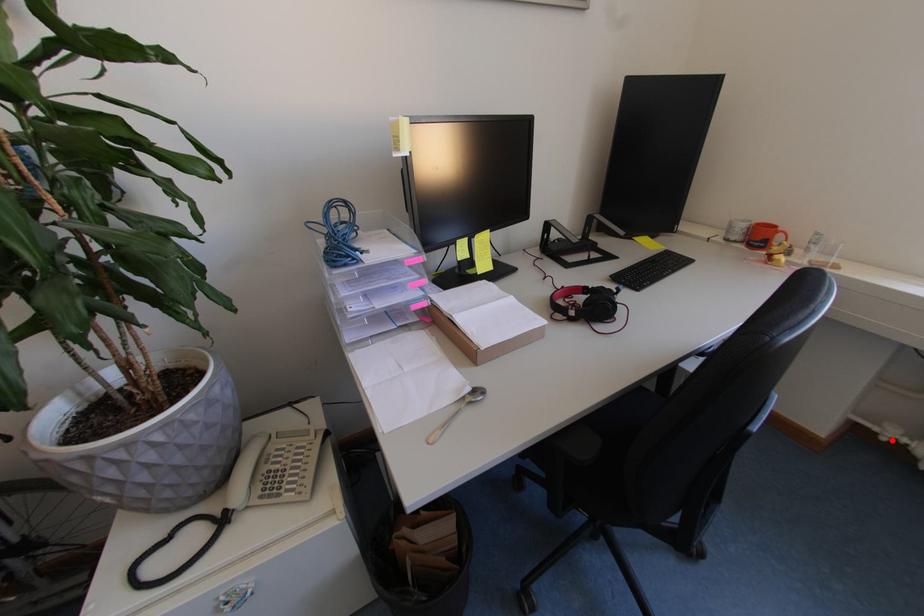
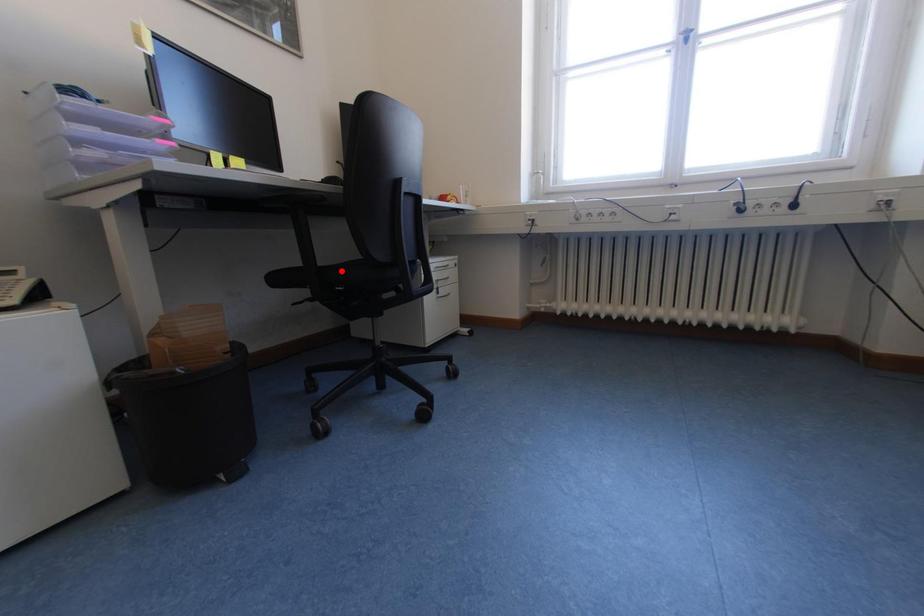
I am providing you with two images of the same scene from different viewpoints. A red point is marked on the first image and another point is marked on the second image. Do the highlighted points in image1 and image2 indicate the same real-world spot?

No